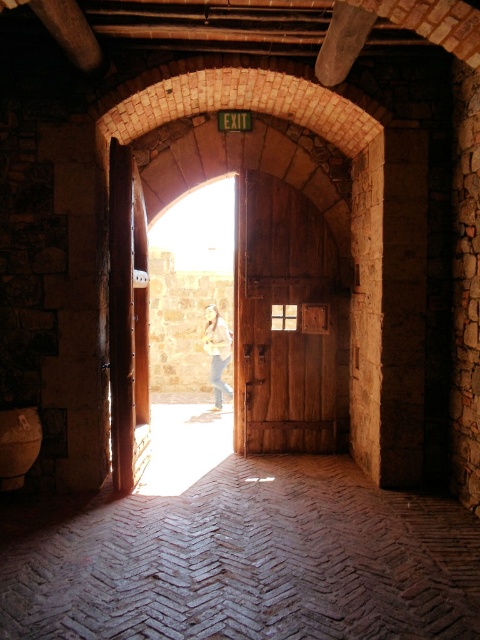
Question: Does wooden door at center come in front of light brown leather jacket at center?

Choices:
 (A) no
 (B) yes

Answer: (B)

Question: Among these objects, which one is farthest from the camera?

Choices:
 (A) wooden door at center
 (B) light brown leather jacket at center

Answer: (B)

Question: Which of the following is the closest to the observer?

Choices:
 (A) light brown leather jacket at center
 (B) wooden door at center

Answer: (B)

Question: Which object is farther from the camera taking this photo?

Choices:
 (A) wooden door at center
 (B) light brown leather jacket at center

Answer: (B)

Question: Is wooden door at center to the left of light brown leather jacket at center from the viewer's perspective?

Choices:
 (A) no
 (B) yes

Answer: (A)

Question: Is wooden door at center in front of light brown leather jacket at center?

Choices:
 (A) yes
 (B) no

Answer: (A)